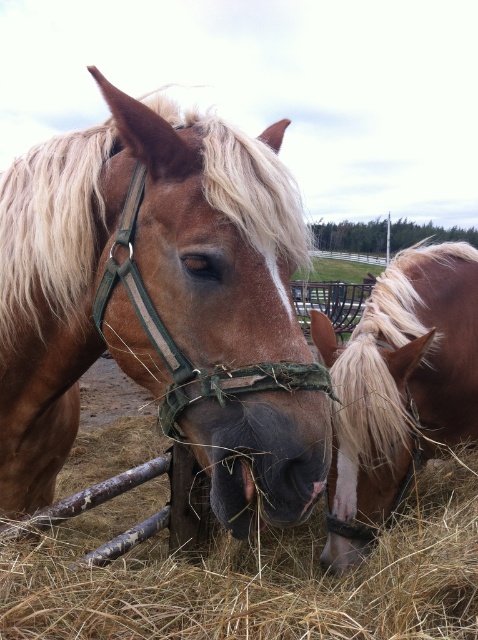
Is brown matte horse at center below blonde mane horse at right?

Yes, brown matte horse at center is below blonde mane horse at right.

In the scene shown: Does brown matte horse at center have a smaller size compared to blonde mane horse at right?

Indeed, brown matte horse at center has a smaller size compared to blonde mane horse at right.

Is point (170, 257) farther from viewer compared to point (431, 349)?

No, it is in front of (431, 349).

This screenshot has height=640, width=478. I want to click on brown matte horse at center, so click(161, 305).

Is brown matte horse at center thinner than brown dry hay at center?

Indeed, brown matte horse at center has a lesser width compared to brown dry hay at center.

Does brown matte horse at center appear under brown dry hay at center?

Incorrect, brown matte horse at center is not positioned below brown dry hay at center.

Who is more forward, (x=171, y=208) or (x=143, y=488)?

Point (x=171, y=208) is in front.

This screenshot has width=478, height=640. What are the coordinates of `brown matte horse at center` in the screenshot? It's located at (161, 305).

Can you confirm if brown dry hay at center is positioned to the right of blonde mane horse at right?

Incorrect, brown dry hay at center is not on the right side of blonde mane horse at right.

Locate an element on the screen. The width and height of the screenshot is (478, 640). brown dry hay at center is located at coordinates click(251, 577).

Where is `brown dry hay at center`? The image size is (478, 640). brown dry hay at center is located at coordinates (251, 577).